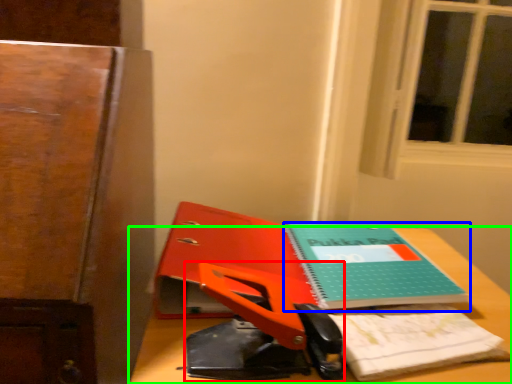
Question: Which object is positioned farthest from scissors (highlighted by a red box)? Select from book (highlighted by a blue box) and desk (highlighted by a green box).

Choices:
 (A) book
 (B) desk

Answer: (A)